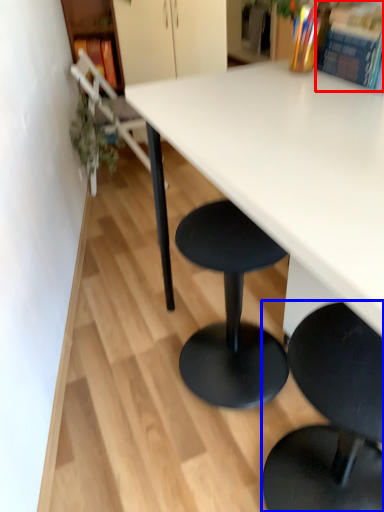
Question: Which of the following is the closest to the observer, book (highlighted by a red box) or chair (highlighted by a blue box)?

Choices:
 (A) book
 (B) chair

Answer: (B)